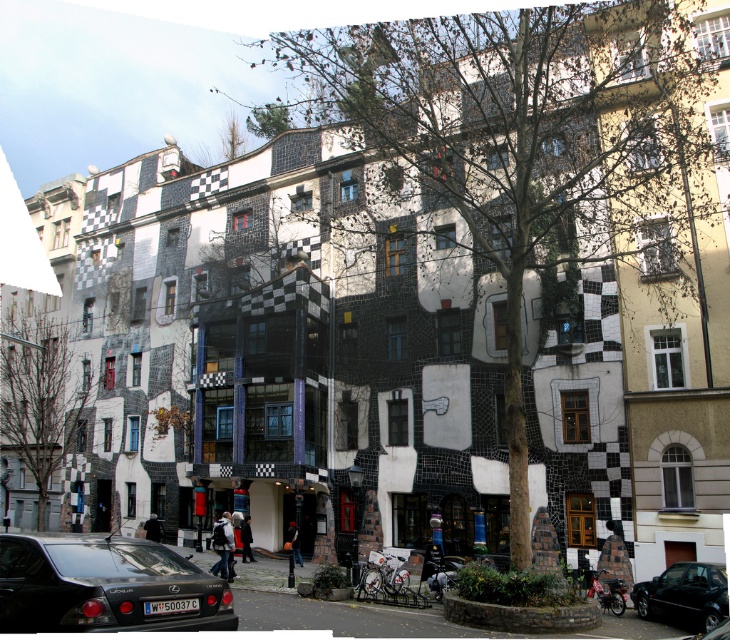
Does shiny black car at lower right appear over dark gray fabric jacket at lower center?

Yes.

Is shiny black car at lower right to the left of dark gray fabric jacket at lower center from the viewer's perspective?

Incorrect, shiny black car at lower right is not on the left side of dark gray fabric jacket at lower center.

The width and height of the screenshot is (730, 640). What do you see at coordinates (683, 593) in the screenshot?
I see `shiny black car at lower right` at bounding box center [683, 593].

Where is `shiny black car at lower right`? Image resolution: width=730 pixels, height=640 pixels. shiny black car at lower right is located at coordinates (683, 593).

Is dark blue fabric jacket at center taller than dark gray fabric jacket at lower center?

Yes, dark blue fabric jacket at center is taller than dark gray fabric jacket at lower center.

Does point (293, 554) lie behind point (147, 520)?

No, (293, 554) is closer to viewer.

Which is behind, point (288, 545) or point (157, 522)?

Positioned behind is point (157, 522).

In order to click on dark blue fabric jacket at center in this screenshot , I will do `click(293, 541)`.

Does shiny black car at lower right have a lesser width compared to dark blue fabric jacket at center?

No, shiny black car at lower right is not thinner than dark blue fabric jacket at center.

Does shiny black car at lower right appear on the right side of dark blue fabric jacket at center?

Yes, shiny black car at lower right is to the right of dark blue fabric jacket at center.

Which is behind, point (645, 598) or point (293, 561)?

The point (293, 561) is more distant.

Locate an element on the screen. The height and width of the screenshot is (640, 730). shiny black car at lower right is located at coordinates (683, 593).